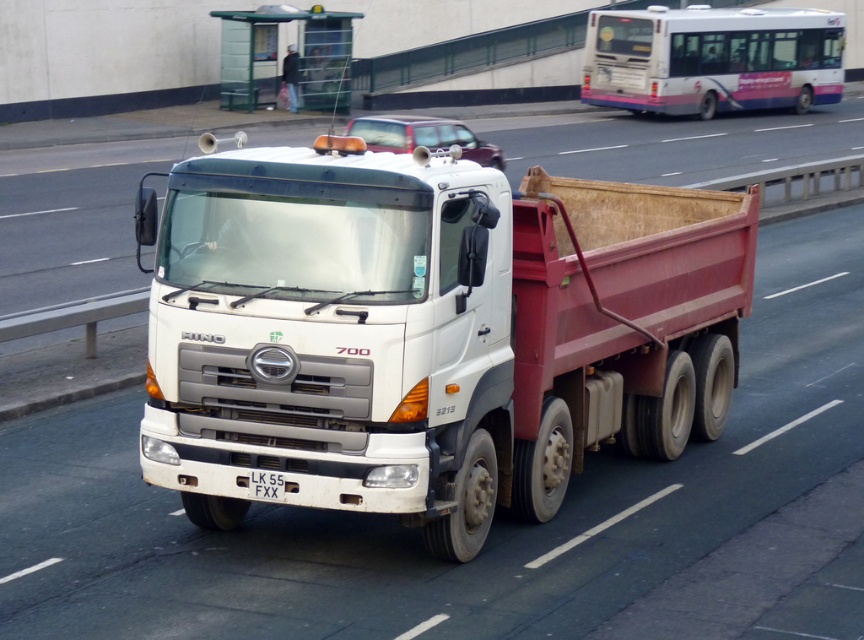
You are a traffic officer standing at the side of the road. You see a white matte truck at center driving towards you. The road has a speed limit of 50 km per hour. If the truck is 9.13 meters away from you, will it stop before reaching you if it starts braking immediately?

The white matte truck at center is 9.13 meters from the camera. To determine if it can stop in time, we need to calculate the braking distance. However, without knowing the truck driver reaction time or deceleration rate, we cannot confirm whether the truck will stop before reaching you. Please provide more information about the truck driver reaction time and deceleration rate.

You are a traffic officer observing the road. You see a white matte truck at center and a white plastic license plate at center. Which object is bigger in size?

The white matte truck at center is bigger in size compared to the white plastic license plate at center.